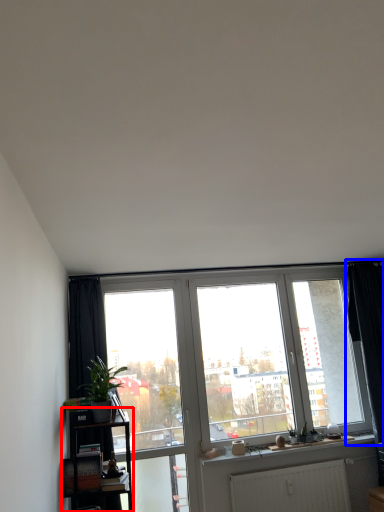
Question: Among these objects, which one is nearest to the camera, shelf (highlighted by a red box) or curtain (highlighted by a blue box)?

Choices:
 (A) shelf
 (B) curtain

Answer: (A)